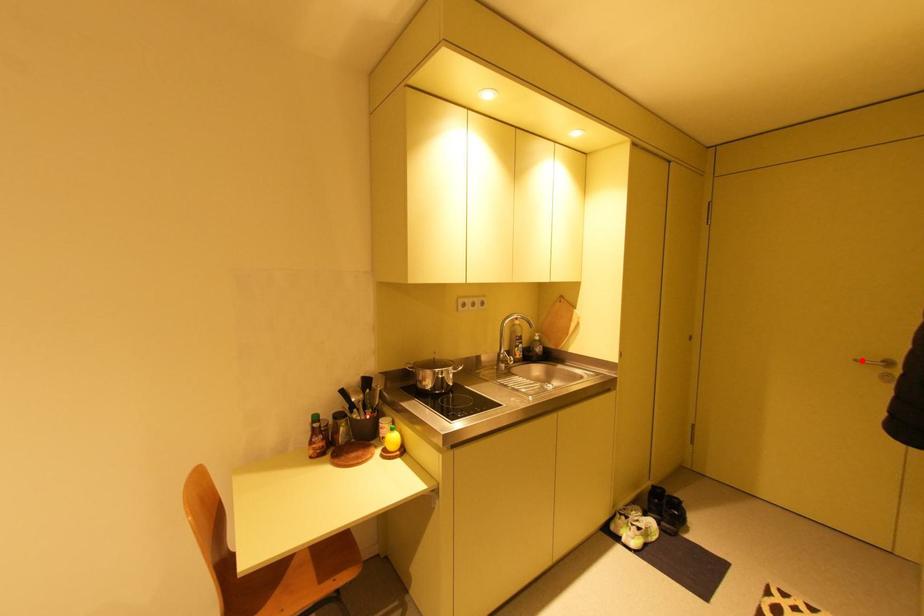
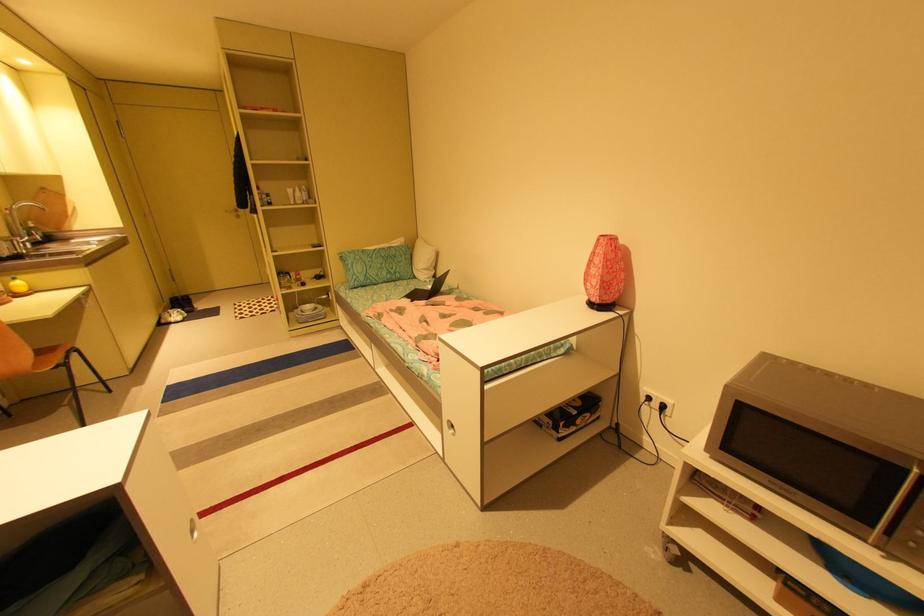
Locate, in the second image, the point that corresponds to the highlighted location in the first image.

(232, 211)